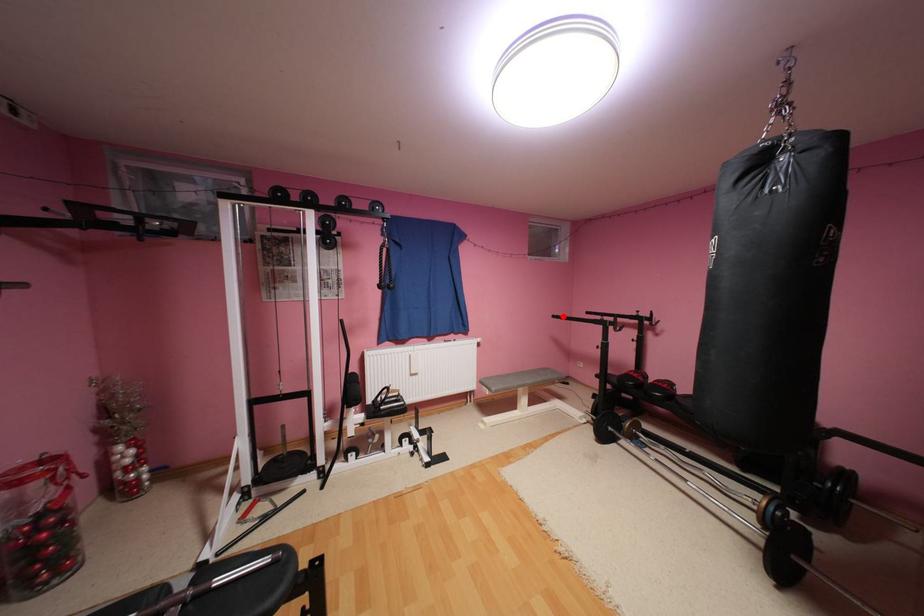
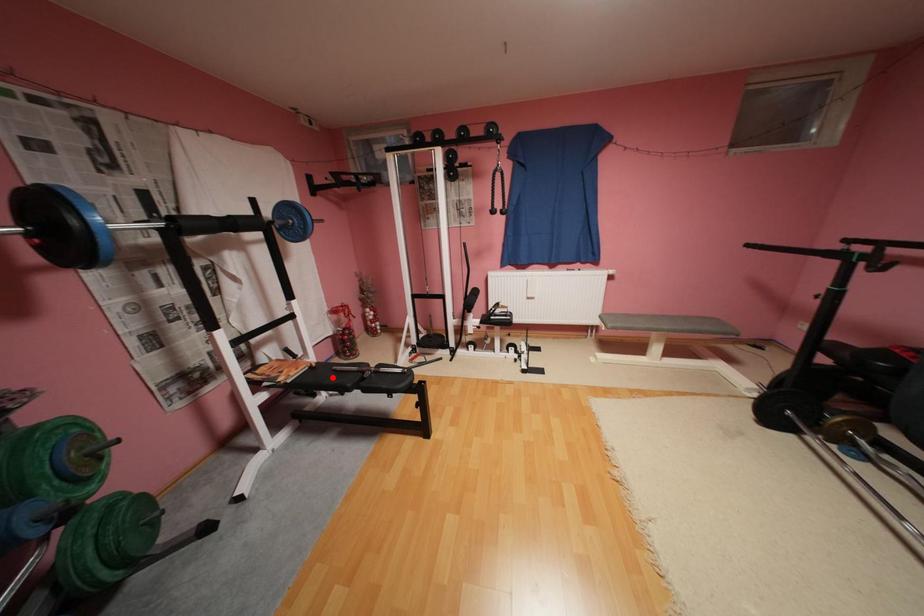
I am providing you with two images of the same scene from different viewpoints. A red point is marked on the first image and another point is marked on the second image. Is the red point in image1 aligned with the point shown in image2?

No